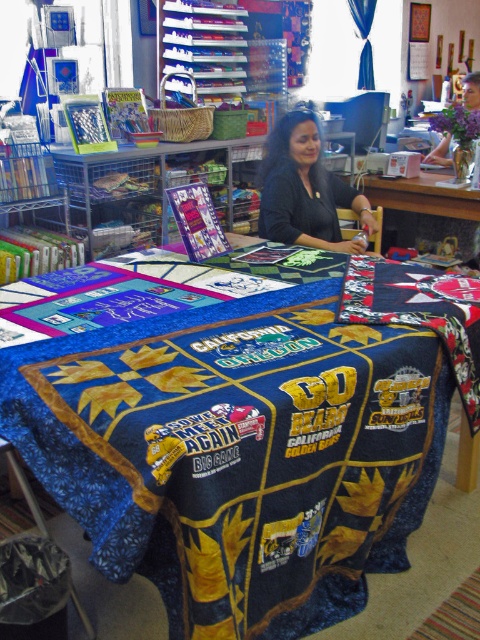
You are a customer in the craft store and want to place a new fabric roll on the table. The fabric roll is 10 cm thick. Can the black fabric at center and the wooden table at center accommodate the fabric roll?

The black fabric at center is thinner than the wooden table at center, so the fabric roll of 10 cm thickness can be placed on the wooden table at center. However, the black fabric at center may not have enough thickness to support the fabric roll properly.

You are organizing a craft fair and need to display the blue fabric quilt at center and the black fabric at center. According to the scene, which one is positioned higher up?

The black fabric at center is positioned higher up since the blue fabric quilt at center is below it.